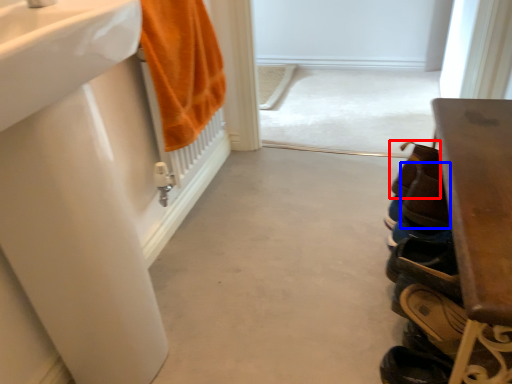
Question: Among these objects, which one is farthest to the camera, shoe (highlighted by a red box) or shoe (highlighted by a blue box)?

Choices:
 (A) shoe
 (B) shoe

Answer: (A)